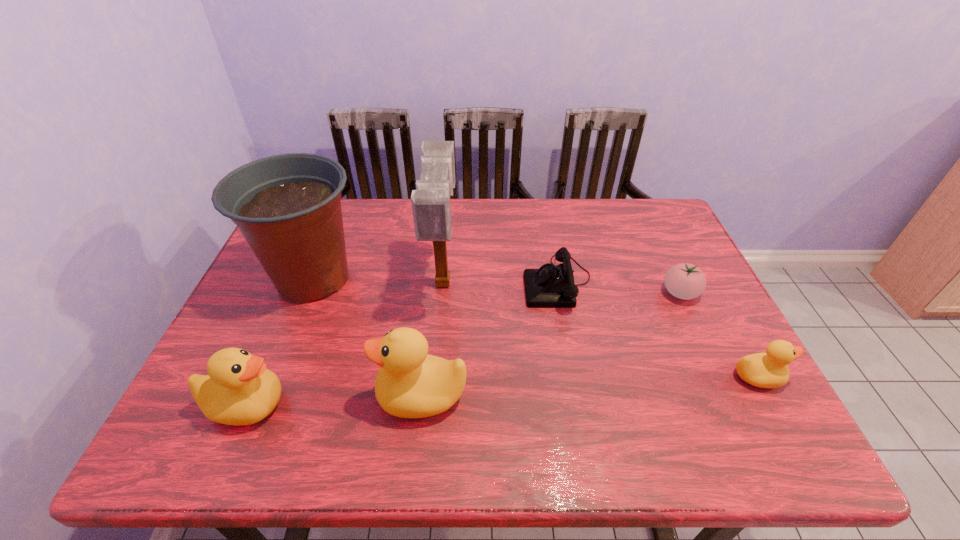
Where is `vacant space located 0.090m at the beak of the second duck from right to left`? vacant space located 0.090m at the beak of the second duck from right to left is located at coordinates (337, 395).

Identify the location of vacant point located 0.050m at the beak of the second duck from right to left. (355, 395).

Where is `vacant space located 0.330m on the front face of the fifth object from left to right`? vacant space located 0.330m on the front face of the fifth object from left to right is located at coordinates (407, 282).

This screenshot has width=960, height=540. I want to click on free spot located 0.320m on the front face of the fifth object from left to right, so click(x=410, y=282).

This screenshot has width=960, height=540. In order to click on vacant space located 0.360m on the front face of the fifth object from left to right in this screenshot , I will do `click(396, 282)`.

Locate an element on the screen. vacant area situated 0.230m on the back of the second tallest object is located at coordinates (344, 204).

The image size is (960, 540). What are the coordinates of `free location located 0.220m on the front of the mallet` in the screenshot? It's located at (433, 393).

Where is `free space located on the back of the tomato`? free space located on the back of the tomato is located at coordinates (642, 211).

The width and height of the screenshot is (960, 540). I want to click on duck that is positioned at the left edge, so click(238, 390).

In order to click on flowerpot at the left edge in this screenshot , I will do 288,208.